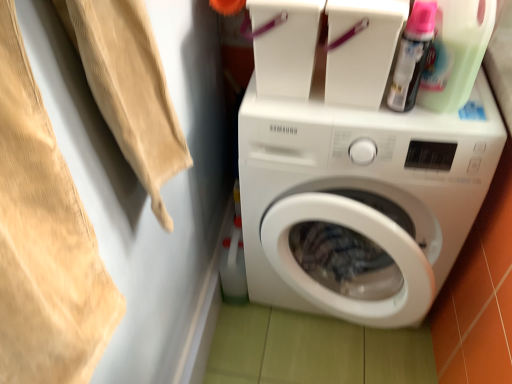
Identify the location of free space to the left of translucent plastic spray can at upper right, the 2th cleaning product positioned from the right. This screenshot has width=512, height=384. (335, 114).